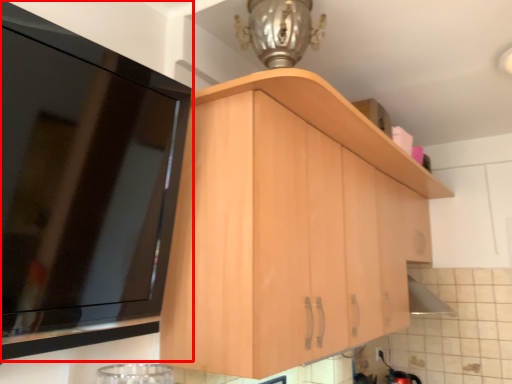
Question: In this image, where is cabinetry (annotated by the red box) located relative to cabinetry?

Choices:
 (A) right
 (B) left

Answer: (B)